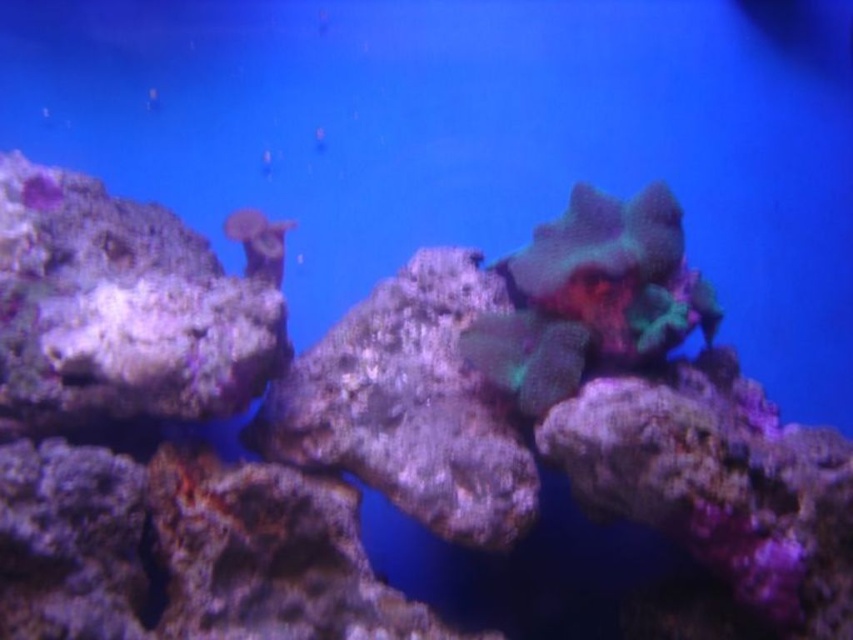
Question: In this image, where is rough textured rock at center located relative to green coral at center?

Choices:
 (A) below
 (B) above

Answer: (A)

Question: Which object is positioned closest to the green coral at center?

Choices:
 (A) translucent coral at upper center
 (B) rough textured rock at center

Answer: (B)

Question: Is rough textured rock at center below green coral at center?

Choices:
 (A) yes
 (B) no

Answer: (A)

Question: Which of the following is the closest to the observer?

Choices:
 (A) translucent coral at upper center
 (B) green coral at center
 (C) rough textured rock at center

Answer: (B)

Question: Which point appears farthest from the camera in this image?

Choices:
 (A) (270, 236)
 (B) (532, 394)
 (C) (287, 449)

Answer: (A)

Question: Can you confirm if rough textured rock at center is positioned below green coral at center?

Choices:
 (A) yes
 (B) no

Answer: (A)